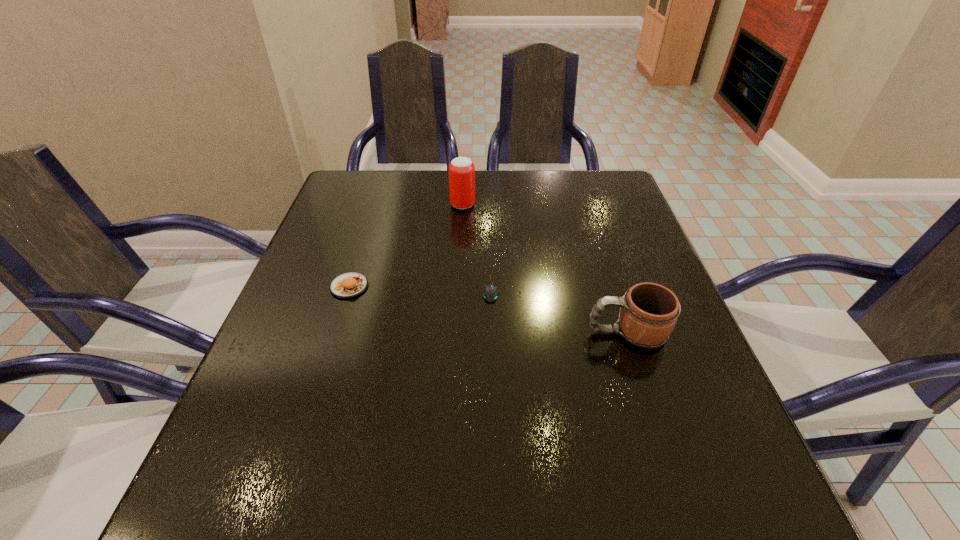
Find the location of a particular element. The width and height of the screenshot is (960, 540). blank area located 0.150m on the side of the second tallest object with the handle is located at coordinates (509, 333).

Where is `vacant space situated on the side of the second tallest object with the handle`? This screenshot has height=540, width=960. vacant space situated on the side of the second tallest object with the handle is located at coordinates (514, 333).

Find the location of a particular element. This screenshot has height=540, width=960. free spot located 0.110m on the front of the third tallest object is located at coordinates (332, 341).

This screenshot has height=540, width=960. In order to click on blank area located 0.280m on the front of the shortest object in this screenshot , I will do `click(495, 429)`.

Identify the location of object that is at the far edge. This screenshot has height=540, width=960. (461, 169).

Where is `object present at the left edge`? object present at the left edge is located at coordinates (351, 284).

In order to click on object that is positioned at the right edge in this screenshot , I will do `click(649, 312)`.

In the image, there is a desktop. Identify the location of free region at the far edge. (535, 200).

In the image, there is a desktop. At what (x,y) coordinates should I click in order to perform the action: click on vacant region at the near edge. Please return your answer as a coordinate pair (x, y). The image size is (960, 540). Looking at the image, I should click on (490, 535).

Identify the location of blank space at the left edge. The height and width of the screenshot is (540, 960). (280, 389).